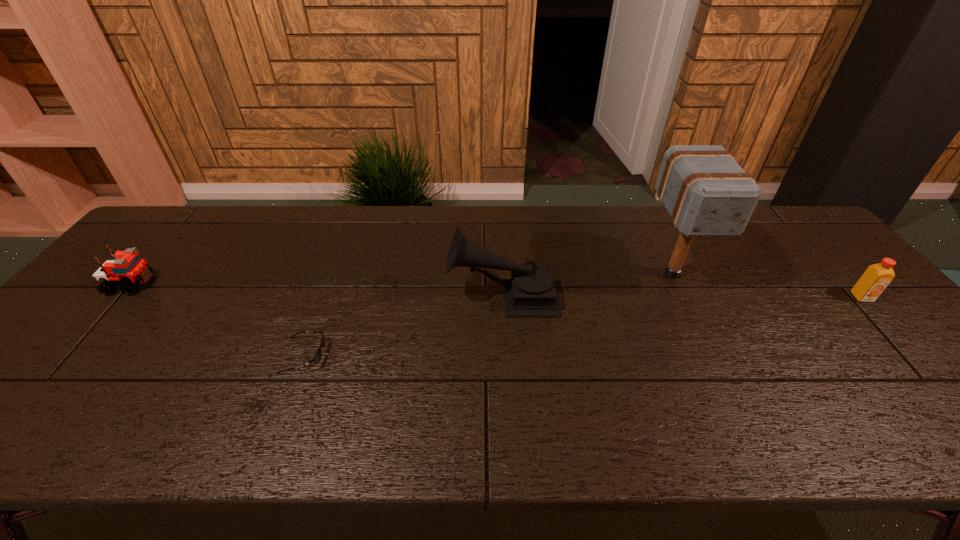
You are a GUI agent. You are given a task and a screenshot of the screen. Output one action in this format:
    pyautogui.click(x=<x>, y=<y>)
    Task: Click on the vacant area at the far left corner of the desktop
    The image size is (960, 540).
    Given the screenshot: What is the action you would take?
    pyautogui.click(x=202, y=217)

I want to click on free space at the near right corner of the desktop, so click(x=957, y=418).

Image resolution: width=960 pixels, height=540 pixels. I want to click on free area in between the tallest object and the second tallest object, so click(x=587, y=284).

Where is `unoccupied position between the Lego and the third object from right to left`? This screenshot has height=540, width=960. unoccupied position between the Lego and the third object from right to left is located at coordinates (317, 289).

I want to click on vacant space that's between the rightmost object and the shortest object, so click(583, 327).

Where is `vacant space in between the third object from left to right and the orange juice`? The height and width of the screenshot is (540, 960). vacant space in between the third object from left to right and the orange juice is located at coordinates (682, 296).

Image resolution: width=960 pixels, height=540 pixels. What are the coordinates of `empty location between the Lego and the orange juice` in the screenshot? It's located at (497, 291).

This screenshot has height=540, width=960. Identify the location of free area in between the leftmost object and the rightmost object. (497, 291).

At what (x,y) coordinates should I click in order to perform the action: click on free space between the sunglasses and the mallet. Please return your answer as a coordinate pair (x, y). Looking at the image, I should click on (488, 315).

You are a GUI agent. You are given a task and a screenshot of the screen. Output one action in this format:
    pyautogui.click(x=<x>, y=<y>)
    Task: Click on the vacant space that's between the rightmost object and the phonograph_record
    Image resolution: width=960 pixels, height=540 pixels.
    Given the screenshot: What is the action you would take?
    [x=682, y=296]